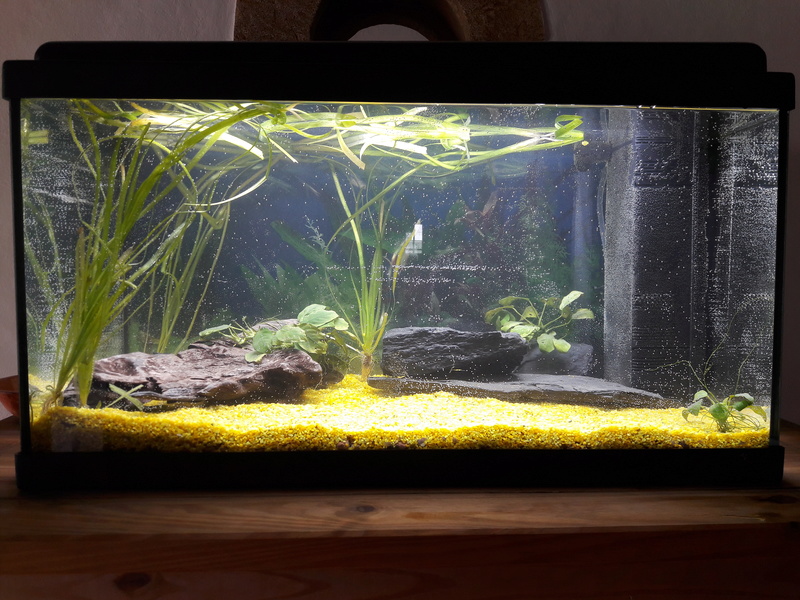
This screenshot has width=800, height=600. What are the coordinates of `wall in background` in the screenshot? It's located at (153, 25).